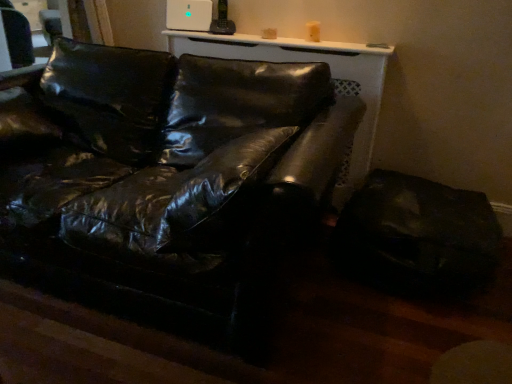
Question: Considering the relative sizes of glossy black leather couch at center and shiny black leather swivel chair at lower right in the image provided, is glossy black leather couch at center taller than shiny black leather swivel chair at lower right?

Choices:
 (A) no
 (B) yes

Answer: (B)

Question: From a real-world perspective, is glossy black leather couch at center physically below shiny black leather swivel chair at lower right?

Choices:
 (A) yes
 (B) no

Answer: (B)

Question: Considering the relative positions of glossy black leather couch at center and shiny black leather swivel chair at lower right in the image provided, is glossy black leather couch at center to the right of shiny black leather swivel chair at lower right from the viewer's perspective?

Choices:
 (A) yes
 (B) no

Answer: (B)

Question: From the image's perspective, would you say glossy black leather couch at center is positioned over shiny black leather swivel chair at lower right?

Choices:
 (A) no
 (B) yes

Answer: (B)

Question: Does glossy black leather couch at center lie behind shiny black leather swivel chair at lower right?

Choices:
 (A) yes
 (B) no

Answer: (B)

Question: From the image's perspective, is glossy black leather couch at center under shiny black leather swivel chair at lower right?

Choices:
 (A) yes
 (B) no

Answer: (B)

Question: Considering the relative positions of shiny black leather swivel chair at lower right and glossy black leather couch at center in the image provided, is shiny black leather swivel chair at lower right in front of glossy black leather couch at center?

Choices:
 (A) no
 (B) yes

Answer: (A)

Question: From a real-world perspective, is shiny black leather swivel chair at lower right beneath glossy black leather couch at center?

Choices:
 (A) no
 (B) yes

Answer: (B)

Question: Considering the relative sizes of shiny black leather swivel chair at lower right and glossy black leather couch at center in the image provided, is shiny black leather swivel chair at lower right wider than glossy black leather couch at center?

Choices:
 (A) yes
 (B) no

Answer: (B)

Question: Is shiny black leather swivel chair at lower right further to the viewer compared to glossy black leather couch at center?

Choices:
 (A) no
 (B) yes

Answer: (B)

Question: Considering the relative sizes of shiny black leather swivel chair at lower right and glossy black leather couch at center in the image provided, is shiny black leather swivel chair at lower right smaller than glossy black leather couch at center?

Choices:
 (A) yes
 (B) no

Answer: (A)

Question: Is shiny black leather swivel chair at lower right thinner than glossy black leather couch at center?

Choices:
 (A) no
 (B) yes

Answer: (B)

Question: Is shiny black leather swivel chair at lower right taller or shorter than glossy black leather couch at center?

Choices:
 (A) tall
 (B) short

Answer: (B)